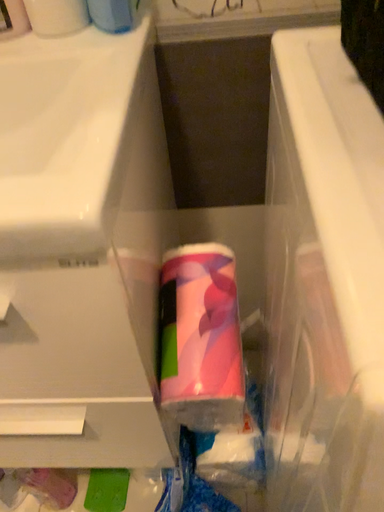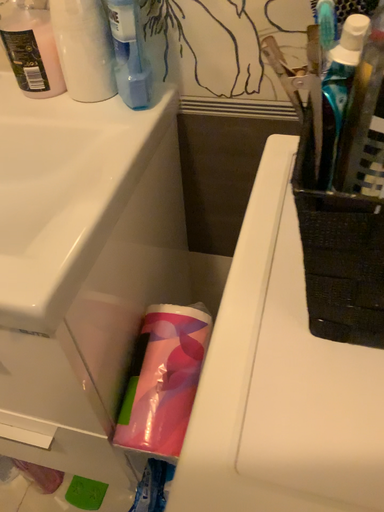
Question: How did the camera likely rotate when shooting the video?

Choices:
 (A) rotated right
 (B) rotated left

Answer: (B)